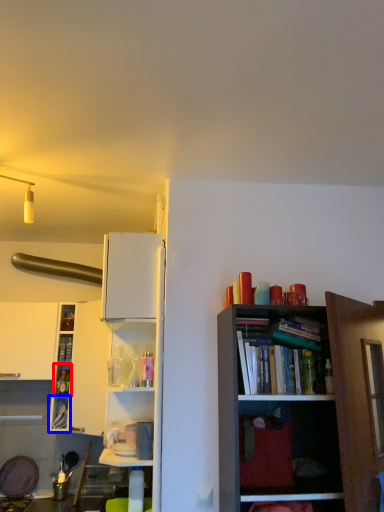
Question: Which object appears closest to the camera in this image, cabinet (highlighted by a red box) or cabinet (highlighted by a blue box)?

Choices:
 (A) cabinet
 (B) cabinet

Answer: (B)